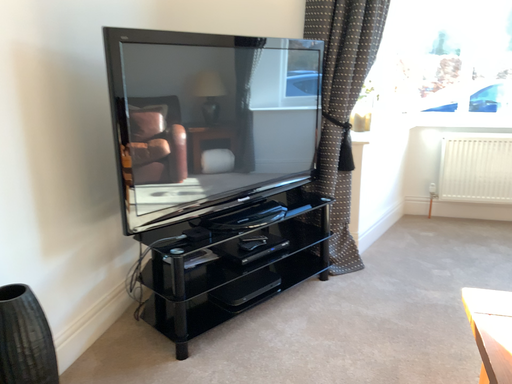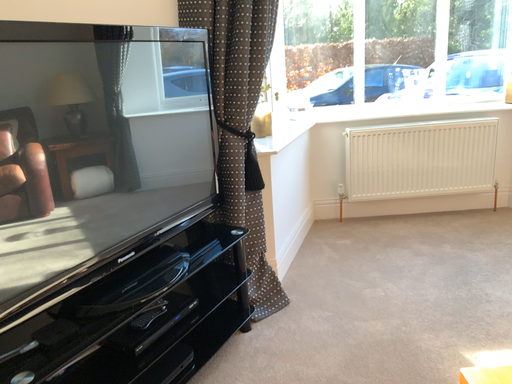
Question: Which way did the camera rotate in the video?

Choices:
 (A) rotated left
 (B) rotated right

Answer: (B)